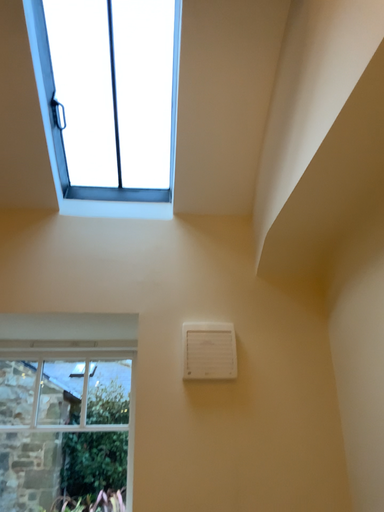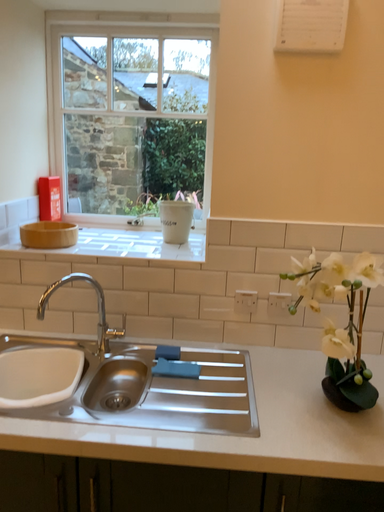
Question: Which way did the camera rotate in the video?

Choices:
 (A) rotated downward
 (B) rotated upward

Answer: (A)